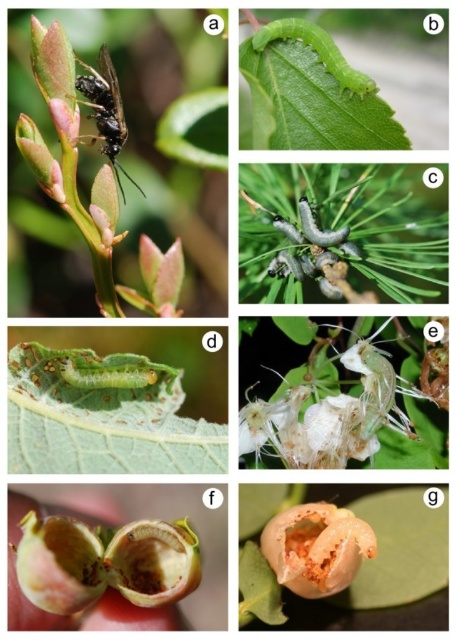
Is translucent orange flower at center wider than black matte insect at upper center?

Yes.

This screenshot has height=640, width=456. Describe the element at coordinates (316, 547) in the screenshot. I see `translucent orange flower at center` at that location.

Which is behind, point (290, 580) or point (102, 134)?

The point (102, 134) is more distant.

Identify the location of translucent orange flower at center. (316, 547).

Which is above, gray-green fuzzy caterpillar at center or green matte caterpillar at upper center?

green matte caterpillar at upper center

Does gray-green fuzzy caterpillar at center appear on the right side of green matte caterpillar at upper center?

Indeed, gray-green fuzzy caterpillar at center is positioned on the right side of green matte caterpillar at upper center.

Describe the element at coordinates (342, 234) in the screenshot. This screenshot has height=640, width=456. I see `gray-green fuzzy caterpillar at center` at that location.

Find the location of a particular element. The width and height of the screenshot is (456, 640). gray-green fuzzy caterpillar at center is located at coordinates (342, 234).

Does black matte insect at upper center appear under green matte caterpillar at upper center?

Yes.

Which is in front, point (119, 145) or point (284, 33)?

Positioned in front is point (119, 145).

At what (x,y) coordinates should I click in order to perform the action: click on black matte insect at upper center. Please return your answer as a coordinate pair (x, y). Looking at the image, I should click on (104, 109).